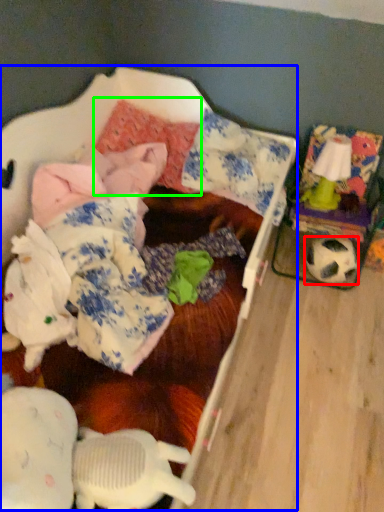
Question: Which is nearer to the football (highlighted by a red box)? bed (highlighted by a blue box) or pillow (highlighted by a green box).

Choices:
 (A) bed
 (B) pillow

Answer: (A)